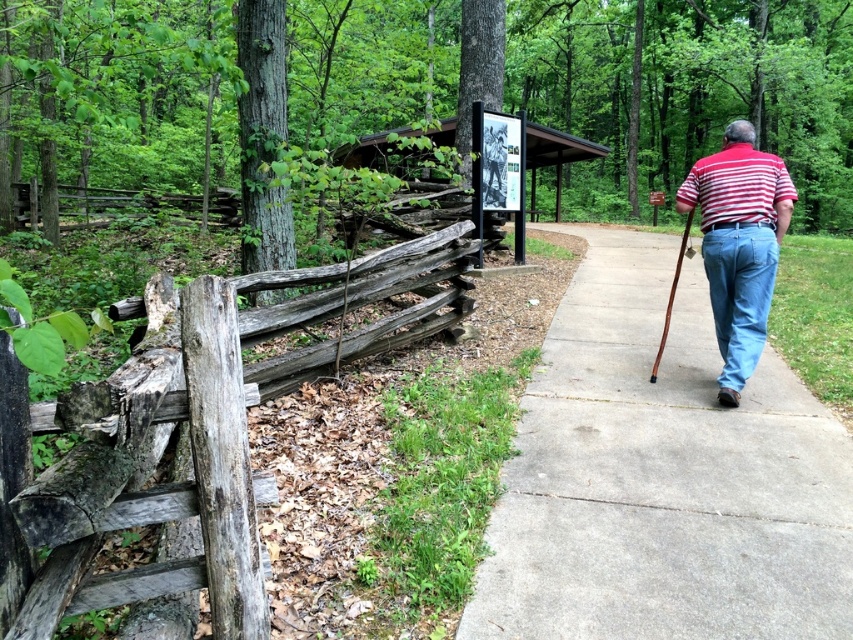
You are a gardener planning to plant flowers along the concrete sidewalk at center and the weathered wood fence at left. Considering their sizes, which area would allow for more flower beds?

The weathered wood fence at left occupies more space than the concrete sidewalk at center, so it would allow for more flower beds.

In the scene shown: You are a photographer trying to capture the man walking away. You notice the striped cotton shirt at right and the light blue denim jeans at right in your viewfinder. Which object should you focus on first if you want to prioritize the one closer to the left side of the frame?

The striped cotton shirt at right is to the left of light blue denim jeans at right, so you should focus on the striped cotton shirt at right first since it is closer to the left side of the frame.

A photographer wants to capture the striped cotton shirt at right in their frame. If the camera has a focal length of 50mm and the shirt is located at coordinates point 0.383, 0.868, what adjustments should they make to ensure the shirt is centered in the photo?

The striped cotton shirt at right is positioned at point (x=740, y=244). To center it, the photographer should adjust the camera to move the shirt to the center coordinates, likely by repositioning the camera or zooming appropriately.